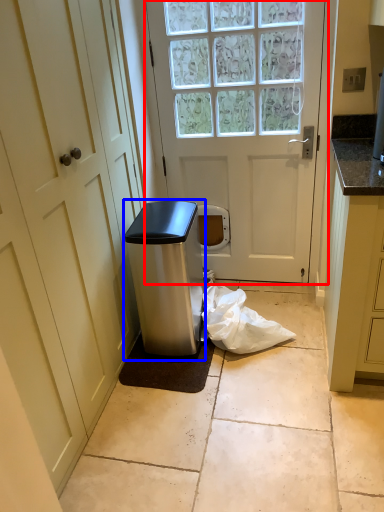
Question: Which point is further to the camera, door (highlighted by a red box) or appliance (highlighted by a blue box)?

Choices:
 (A) door
 (B) appliance

Answer: (A)